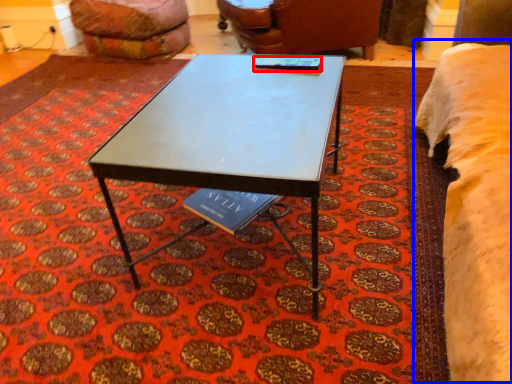
Question: Which of the following is the closest to the observer, table tennis table (highlighted by a red box) or bed (highlighted by a blue box)?

Choices:
 (A) table tennis table
 (B) bed

Answer: (B)